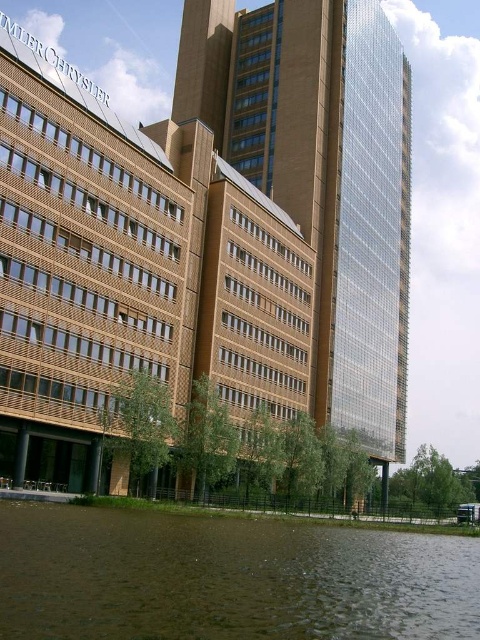
Is glassy reflective tower at center thinner than brown murky water at lower center?

In fact, glassy reflective tower at center might be wider than brown murky water at lower center.

Which is behind, point (313, 385) or point (225, 611)?

Point (313, 385)

Is point (381, 24) positioned in front of point (435, 600)?

No, (381, 24) is behind (435, 600).

At what (x,y) coordinates should I click in order to perform the action: click on glassy reflective tower at center. Please return your answer as a coordinate pair (x, y). This screenshot has height=640, width=480. Looking at the image, I should click on (322, 177).